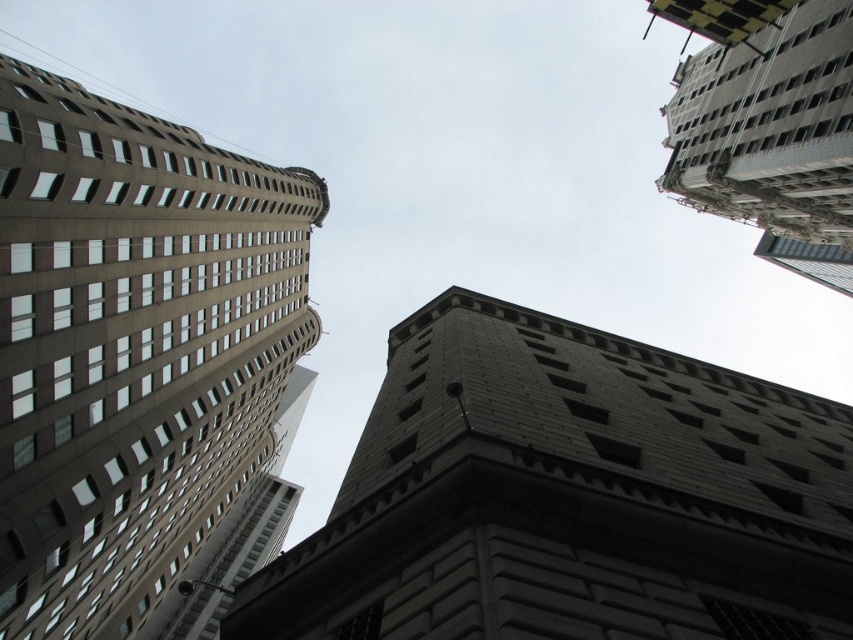
You are a drone operator tasked with flying a drone between two buildings in the city. You need to ensure the drone can safely pass between the gray stone tower at center and the gray concrete building at upper right. The drone requires a minimum of 30 meters of clearance between the two buildings to avoid collision. Based on the scene, can the drone safely navigate this path?

The gray stone tower at center is 32.86 meters from gray concrete building at upper right. Since the required clearance is 30 meters, the distance between them is sufficient, so the drone can safely navigate this path between the gray stone tower at center and the gray concrete building at upper right.

You are standing on the ground floor of a nearby building and looking up at the brown concrete building at left and the gray concrete building at upper right. Which building appears higher in your field of view?

The gray concrete building at upper right appears higher in your field of view because it is located above the brown concrete building at left.

You are standing on the street below and want to take a photo of both the gray stone tower at center and the gray concrete building at upper right. Which building should you aim your camera towards first if you want to capture them both in one frame?

You should aim your camera towards the gray stone tower at center first because it is positioned on the left side of the gray concrete building at upper right, so capturing the left side first will ensure both are in the frame.